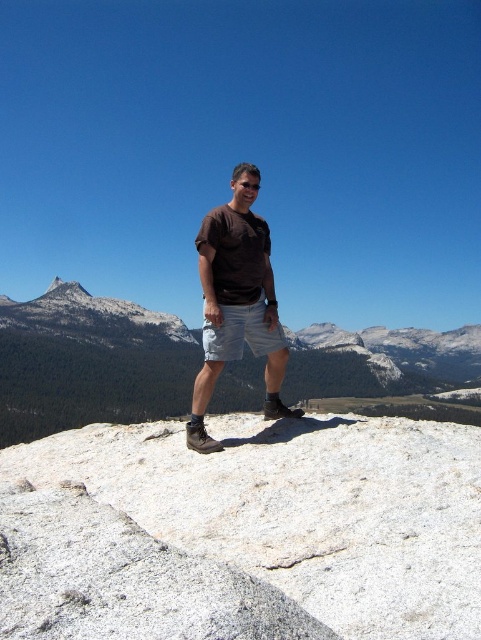
Question: Is white granite rock at center further to the viewer compared to gray/granite mountain at center?

Choices:
 (A) yes
 (B) no

Answer: (B)

Question: Can you confirm if white granite rock at center is thinner than gray/granite peak at upper left?

Choices:
 (A) no
 (B) yes

Answer: (B)

Question: Is white granite rock at center thinner than gray/granite peak at upper left?

Choices:
 (A) no
 (B) yes

Answer: (B)

Question: Considering the real-world distances, which object is closest to the white cotton shorts at center?

Choices:
 (A) gray/granite mountain at center
 (B) black matte goggles at center
 (C) gray/granite peak at upper left

Answer: (B)

Question: Which point is farther from the camera taking this photo?

Choices:
 (A) (42, 364)
 (B) (243, 180)
 (C) (228, 310)
 (D) (74, 625)

Answer: (A)

Question: Which point is closer to the camera?

Choices:
 (A) black matte goggles at center
 (B) gray/granite mountain at center

Answer: (A)